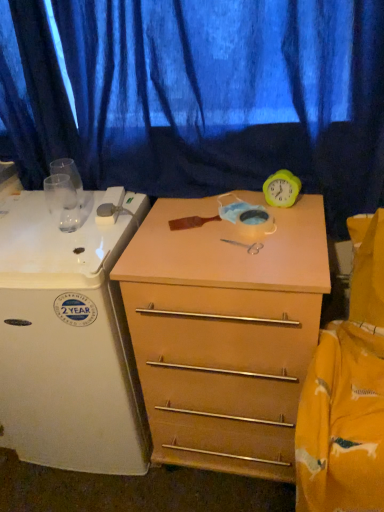
The width and height of the screenshot is (384, 512). Describe the element at coordinates (67, 343) in the screenshot. I see `white glossy refrigerator at left` at that location.

What do you see at coordinates (282, 189) in the screenshot?
I see `yellow rubber clock at upper right` at bounding box center [282, 189].

Find the location of a particular element. This screenshot has height=512, width=384. white glossy refrigerator at left is located at coordinates (67, 343).

Is yellow rubber clock at upper right touching blue fabric curtain at upper center?

yellow rubber clock at upper right and blue fabric curtain at upper center are clearly separated.

Is yellow rubber clock at upper right not inside blue fabric curtain at upper center?

Actually, yellow rubber clock at upper right is within blue fabric curtain at upper center.

From the image's perspective, between yellow rubber clock at upper right and blue fabric curtain at upper center, which one is located above?

From the image's view, blue fabric curtain at upper center is above.

Is yellow rubber clock at upper right smaller than blue fabric curtain at upper center?

Correct, yellow rubber clock at upper right occupies less space than blue fabric curtain at upper center.

Does point (223, 322) come behind point (289, 183)?

No, (223, 322) is closer to viewer.

Which object is thinner, light wood/finish chest of drawers at center or yellow rubber clock at upper right?

yellow rubber clock at upper right is thinner.

Is light wood/finish chest of drawers at center aimed at yellow rubber clock at upper right?

No, light wood/finish chest of drawers at center is not turned towards yellow rubber clock at upper right.

Is light wood/finish chest of drawers at center at the left side of yellow rubber clock at upper right?

Indeed, light wood/finish chest of drawers at center is positioned on the left side of yellow rubber clock at upper right.

Considering the positions of objects yellow rubber clock at upper right and white glossy refrigerator at left in the image provided, who is more to the left, yellow rubber clock at upper right or white glossy refrigerator at left?

From the viewer's perspective, white glossy refrigerator at left appears more on the left side.

In the scene shown: Which object is closer to the camera taking this photo, yellow rubber clock at upper right or white glossy refrigerator at left?

white glossy refrigerator at left is more forward.

From a real-world perspective, is yellow rubber clock at upper right above or below white glossy refrigerator at left?

yellow rubber clock at upper right is above white glossy refrigerator at left.

Which is nearer, (278, 178) or (15, 257)?

The point (15, 257) is in front.

Which object is closer to the camera taking this photo, white glossy refrigerator at left or blue fabric curtain at upper center?

Positioned in front is blue fabric curtain at upper center.

From the image's perspective, is white glossy refrigerator at left under blue fabric curtain at upper center?

Correct, white glossy refrigerator at left appears lower than blue fabric curtain at upper center in the image.

Considering the points (24, 332) and (161, 76), which point is behind, point (24, 332) or point (161, 76)?

The point (161, 76) is behind.

Is blue fabric curtain at upper center a part of white glossy refrigerator at left?

No, white glossy refrigerator at left does not contain blue fabric curtain at upper center.

How different are the orientations of light wood/finish chest of drawers at center and blue fabric curtain at upper center in degrees?

The facing directions of light wood/finish chest of drawers at center and blue fabric curtain at upper center are 0.202 degrees apart.

Are light wood/finish chest of drawers at center and blue fabric curtain at upper center beside each other?

No, light wood/finish chest of drawers at center is not touching blue fabric curtain at upper center.

Between light wood/finish chest of drawers at center and blue fabric curtain at upper center, which one has smaller width?

blue fabric curtain at upper center.

From the image's perspective, which one is positioned lower, light wood/finish chest of drawers at center or blue fabric curtain at upper center?

light wood/finish chest of drawers at center, from the image's perspective.

Who is bigger, white glossy refrigerator at left or light wood/finish chest of drawers at center?

Bigger between the two is white glossy refrigerator at left.

Is white glossy refrigerator at left not inside light wood/finish chest of drawers at center?

Yes, white glossy refrigerator at left is located beyond the bounds of light wood/finish chest of drawers at center.

Which object is wider, white glossy refrigerator at left or light wood/finish chest of drawers at center?

white glossy refrigerator at left.

From the picture: How far apart are blue fabric curtain at upper center and white glossy refrigerator at left?

blue fabric curtain at upper center and white glossy refrigerator at left are 20.15 inches apart.

Is blue fabric curtain at upper center next to white glossy refrigerator at left?

No, blue fabric curtain at upper center is not touching white glossy refrigerator at left.

From a real-world perspective, who is located higher, blue fabric curtain at upper center or white glossy refrigerator at left?

From a 3D spatial view, blue fabric curtain at upper center is above.

Which is closer to the camera, (322,158) or (110,437)?

Point (322,158)

I want to click on clock located on the right of blue fabric curtain at upper center, so click(x=282, y=189).

What are the coordinates of `chest of drawers to the left of yellow rubber clock at upper right` in the screenshot? It's located at (224, 332).

When comparing their distances from white glossy refrigerator at left, does yellow rubber clock at upper right or blue fabric curtain at upper center seem further?

yellow rubber clock at upper right lies further to white glossy refrigerator at left than the other object.

Looking at the image, which one is located further to blue fabric curtain at upper center, yellow rubber clock at upper right or light wood/finish chest of drawers at center?

Among the two, light wood/finish chest of drawers at center is located further to blue fabric curtain at upper center.

Looking at the image, which one is located closer to yellow rubber clock at upper right, white glossy refrigerator at left or light wood/finish chest of drawers at center?

Based on the image, light wood/finish chest of drawers at center appears to be nearer to yellow rubber clock at upper right.

Considering their positions, is blue fabric curtain at upper center positioned further to light wood/finish chest of drawers at center than yellow rubber clock at upper right?

Based on the image, blue fabric curtain at upper center appears to be further to light wood/finish chest of drawers at center.

When comparing their distances from yellow rubber clock at upper right, does blue fabric curtain at upper center or light wood/finish chest of drawers at center seem further?

light wood/finish chest of drawers at center is positioned further to the anchor yellow rubber clock at upper right.

Looking at this image, from the image, which object appears to be nearer to blue fabric curtain at upper center, yellow rubber clock at upper right or white glossy refrigerator at left?

yellow rubber clock at upper right is positioned closer to the anchor blue fabric curtain at upper center.

Looking at the image, which one is located closer to yellow rubber clock at upper right, blue fabric curtain at upper center or white glossy refrigerator at left?

blue fabric curtain at upper center is positioned closer to the anchor yellow rubber clock at upper right.

Which object lies further to the anchor point white glossy refrigerator at left, yellow rubber clock at upper right or light wood/finish chest of drawers at center?

yellow rubber clock at upper right lies further to white glossy refrigerator at left than the other object.

At what (x,y) coordinates should I click in order to perform the action: click on curtain between white glossy refrigerator at left and yellow rubber clock at upper right in the horizontal direction. Please return your answer as a coordinate pair (x, y). Image resolution: width=384 pixels, height=512 pixels. Looking at the image, I should click on (200, 95).

Where is `the chest of drawers situated between white glossy refrigerator at left and yellow rubber clock at upper right from left to right`? Image resolution: width=384 pixels, height=512 pixels. the chest of drawers situated between white glossy refrigerator at left and yellow rubber clock at upper right from left to right is located at coordinates (224, 332).

This screenshot has width=384, height=512. I want to click on appliance between blue fabric curtain at upper center and light wood/finish chest of drawers at center vertically, so click(x=67, y=343).

Find the location of a particular element. The width and height of the screenshot is (384, 512). clock between blue fabric curtain at upper center and light wood/finish chest of drawers at center in the vertical direction is located at coordinates (282, 189).